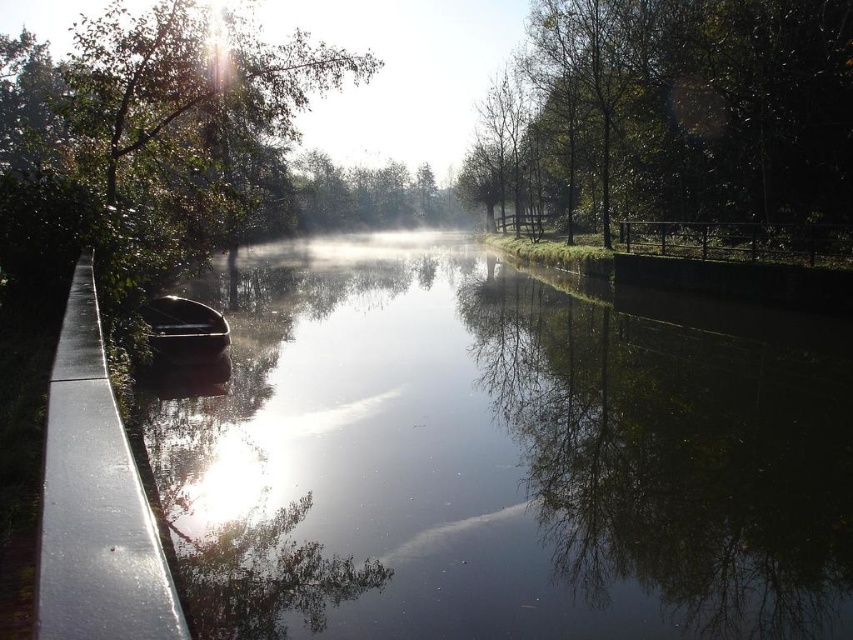
Question: Can you confirm if black glossy water at left is positioned above shiny black canoe at center?

Choices:
 (A) no
 (B) yes

Answer: (A)

Question: Which point appears closest to the camera in this image?

Choices:
 (A) (161, 356)
 (B) (786, 93)
 (C) (614, 545)

Answer: (C)

Question: Which point is closer to the camera?

Choices:
 (A) (15, 145)
 (B) (363, 564)
 (C) (154, 323)

Answer: (B)

Question: Which object is closer to the camera taking this photo?

Choices:
 (A) shiny black canoe at center
 (B) green leafy tree at upper right
 (C) black glossy water at left

Answer: (C)

Question: Does black glossy water at left have a greater width compared to shiny black canoe at center?

Choices:
 (A) yes
 (B) no

Answer: (A)

Question: Is black glossy water at left smaller than green leafy tree at left?

Choices:
 (A) no
 (B) yes

Answer: (B)